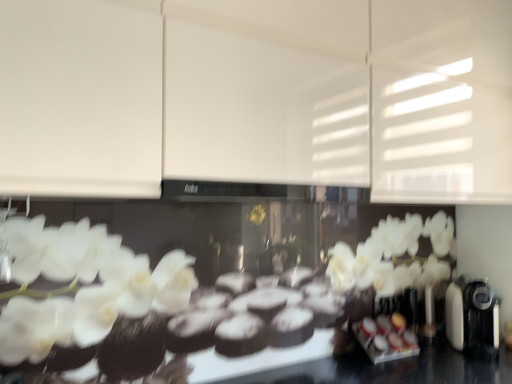
Image resolution: width=512 pixels, height=384 pixels. Identify the location of white glossy canisters at center. (386, 338).

I want to click on black plastic coffee machine at right, so click(473, 318).

Is white matte cabinet at upper center not close to white glossy canisters at center?

No, there isn't a large distance between white matte cabinet at upper center and white glossy canisters at center.

Between white matte cabinet at upper center and white glossy canisters at center, which one has larger width?

Wider between the two is white matte cabinet at upper center.

Is white glossy canisters at center located within white matte cabinet at upper center?

No.

From the picture: Between white matte cabinet at upper center and white glossy canisters at center, which one is positioned behind?

white glossy canisters at center is behind.

Between white glossy canisters at center and black plastic coffee machine at right, which one has larger width?

Wider between the two is black plastic coffee machine at right.

Considering the sizes of white glossy canisters at center and black plastic coffee machine at right in the image, is white glossy canisters at center taller or shorter than black plastic coffee machine at right?

Considering their sizes, white glossy canisters at center has less height than black plastic coffee machine at right.

From the picture: Would you consider white glossy canisters at center to be distant from black plastic coffee machine at right?

white glossy canisters at center is actually quite close to black plastic coffee machine at right.

From a real-world perspective, which is physically above, black plastic coffee machine at right or white matte cabinet at upper center?

white matte cabinet at upper center.

Consider the image. Which point is more forward, (461, 320) or (426, 139)?

The point (426, 139) is closer to the camera.

Does black plastic coffee machine at right contain white matte cabinet at upper center?

That's incorrect, white matte cabinet at upper center is not inside black plastic coffee machine at right.

In the image, is black plastic coffee machine at right on the left side or the right side of white matte cabinet at upper center?

black plastic coffee machine at right is positioned on white matte cabinet at upper center's right side.

From a real-world perspective, who is located higher, white glossy canisters at center or white matte cabinet at upper center?

In real-world perspective, white matte cabinet at upper center is above.

Between white glossy canisters at center and white matte cabinet at upper center, which one has more height?

white matte cabinet at upper center is taller.

Would you say white glossy canisters at center is outside white matte cabinet at upper center?

white glossy canisters at center is positioned outside white matte cabinet at upper center.

From the image's perspective, does white glossy canisters at center appear lower than white matte cabinet at upper center?

Yes.

Is white matte cabinet at upper center located outside black plastic coffee machine at right?

white matte cabinet at upper center is positioned outside black plastic coffee machine at right.

Between white matte cabinet at upper center and black plastic coffee machine at right, which one has more height?

With more height is white matte cabinet at upper center.

In terms of width, does white matte cabinet at upper center look wider or thinner when compared to black plastic coffee machine at right?

In the image, white matte cabinet at upper center appears to be more narrow than black plastic coffee machine at right.

Which is further, (462, 0) or (458, 303)?

The point (458, 303) is farther from the camera.

Looking at the image, does black plastic coffee machine at right seem bigger or smaller compared to white glossy canisters at center?

Considering their sizes, black plastic coffee machine at right takes up more space than white glossy canisters at center.

Looking at this image, does black plastic coffee machine at right have a greater height compared to white glossy canisters at center?

Yes.

What's the angular difference between black plastic coffee machine at right and white glossy canisters at center's facing directions?

They differ by 43.4 degrees in their facing directions.

Find the location of a particular element. Image resolution: width=512 pixels, height=384 pixels. cabinetry located above the white glossy canisters at center (from the image's perspective) is located at coordinates (258, 96).

The height and width of the screenshot is (384, 512). Find the location of `food lying below the black plastic coffee machine at right (from the image's perspective)`. food lying below the black plastic coffee machine at right (from the image's perspective) is located at coordinates (386, 338).

Based on their spatial positions, is black plastic coffee machine at right or white glossy canisters at center further from white matte cabinet at upper center?

The object further to white matte cabinet at upper center is white glossy canisters at center.

Consider the image. Which object lies further to the anchor point white matte cabinet at upper center, white glossy canisters at center or black plastic coffee machine at right?

white glossy canisters at center.

Which object lies further to the anchor point white glossy canisters at center, white matte cabinet at upper center or black plastic coffee machine at right?

The object further to white glossy canisters at center is white matte cabinet at upper center.

In the scene shown: When comparing their distances from white glossy canisters at center, does black plastic coffee machine at right or white matte cabinet at upper center seem closer?

black plastic coffee machine at right lies closer to white glossy canisters at center than the other object.

Consider the image. When comparing their distances from black plastic coffee machine at right, does white matte cabinet at upper center or white glossy canisters at center seem further?

The object further to black plastic coffee machine at right is white matte cabinet at upper center.

Looking at the image, which one is located further to black plastic coffee machine at right, white glossy canisters at center or white matte cabinet at upper center?

white matte cabinet at upper center is positioned further to the anchor black plastic coffee machine at right.

Image resolution: width=512 pixels, height=384 pixels. In order to click on coffee machine that lies between white matte cabinet at upper center and white glossy canisters at center from top to bottom in this screenshot , I will do `click(473, 318)`.